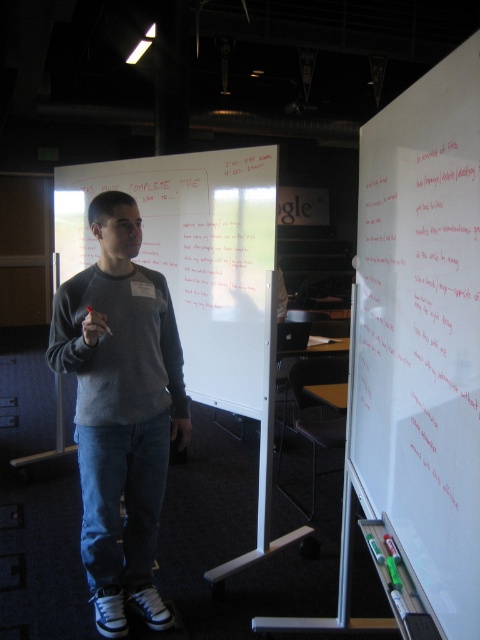
Can you confirm if white matte whiteboard at right is positioned to the right of white matte whiteboard at center?

Correct, you'll find white matte whiteboard at right to the right of white matte whiteboard at center.

Is point (396, 468) less distant than point (230, 164)?

Yes, point (396, 468) is closer to viewer.

Where is `white matte whiteboard at right`? This screenshot has height=640, width=480. white matte whiteboard at right is located at coordinates (420, 348).

Who is more forward, (130,468) or (223,404)?

Point (130,468)

Is point (136, 422) closer to camera compared to point (195, 296)?

Yes, it is in front of point (195, 296).

Where is `gray matte sweater at center`? This screenshot has height=640, width=480. gray matte sweater at center is located at coordinates (120, 408).

Describe the element at coordinates (420, 348) in the screenshot. I see `white matte whiteboard at right` at that location.

Does white matte whiteboard at right have a greater width compared to gray matte sweater at center?

Incorrect, white matte whiteboard at right's width does not surpass gray matte sweater at center's.

Between point (463, 596) and point (153, 438), which one is positioned behind?

Point (153, 438)

I want to click on white matte whiteboard at right, so click(x=420, y=348).